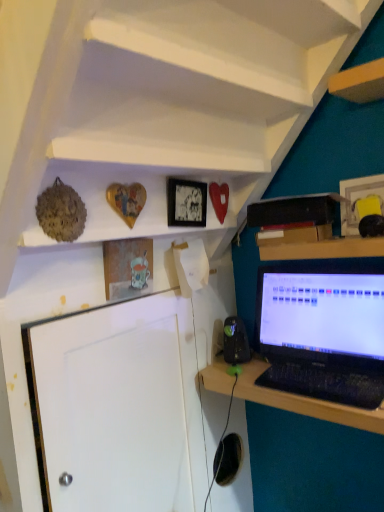
This screenshot has height=512, width=384. Describe the element at coordinates (186, 203) in the screenshot. I see `matte black picture frame at upper center, which ranks as the 2th picture frame in left-to-right order` at that location.

Describe the element at coordinates (124, 265) in the screenshot. I see `matte glass picture frame at upper center, the 1th picture frame positioned from the left` at that location.

Where is `white matte shelf at upper center, arranged as the first shelf when viewed from the top`? Image resolution: width=384 pixels, height=512 pixels. white matte shelf at upper center, arranged as the first shelf when viewed from the top is located at coordinates (236, 39).

Image resolution: width=384 pixels, height=512 pixels. What do you see at coordinates (147, 196) in the screenshot? I see `wooden heart at upper center, arranged as the 2th shelf when viewed from the top` at bounding box center [147, 196].

What is the approximate width of wooden desk at lower right?

The width of wooden desk at lower right is 13.17 inches.

This screenshot has width=384, height=512. Find the location of `black glossy laptop at right`. black glossy laptop at right is located at coordinates (323, 329).

Locate an element on the screen. black plastic speaker at lower center is located at coordinates (235, 341).

Considering the sizes of objects wooden desk at lower right and black plastic keyboard at lower right in the image provided, who is bigger, wooden desk at lower right or black plastic keyboard at lower right?

wooden desk at lower right is bigger.

Where is `computer keyboard behind the wooden desk at lower right`? computer keyboard behind the wooden desk at lower right is located at coordinates (325, 384).

Is wooden desk at lower right oriented away from black plastic keyboard at lower right?

wooden desk at lower right is not turned away from black plastic keyboard at lower right.

Is wooden heart at upper center, arranged as the 2th shelf when viewed from the top, at the left side of black plastic keyboard at lower right?

Yes, wooden heart at upper center, arranged as the 2th shelf when viewed from the top, is to the left of black plastic keyboard at lower right.

Which shelf is the 2nd one when counting from the left side of the black plastic keyboard at lower right? Please provide its 2D coordinates.

[(147, 196)]

From a real-world perspective, who is located higher, wooden heart at upper center, arranged as the 2th shelf when viewed from the top, or black plastic keyboard at lower right?

In real-world perspective, wooden heart at upper center, arranged as the 2th shelf when viewed from the top, is above.

Considering their positions, is black plastic keyboard at lower right located in front of or behind black glossy laptop at right?

Clearly, black plastic keyboard at lower right is in front of black glossy laptop at right.

From the image's perspective, is black plastic keyboard at lower right above black glossy laptop at right?

Incorrect, from the image's perspective, black plastic keyboard at lower right is lower than black glossy laptop at right.

In the scene shown: Between black plastic keyboard at lower right and black glossy laptop at right, which one has more height?

Standing taller between the two is black glossy laptop at right.

Does black plastic keyboard at lower right have a lesser width compared to black glossy laptop at right?

Incorrect, the width of black plastic keyboard at lower right is not less than that of black glossy laptop at right.

Is the depth of matte glass picture frame at upper center, the 1th picture frame positioned from the left, greater than that of matte black picture frame at upper center, which ranks as the 2th picture frame in left-to-right order?

No.

Is matte glass picture frame at upper center, the 1th picture frame positioned from the left, completely or partially outside of matte black picture frame at upper center, which ranks as the 2th picture frame in left-to-right order?

matte glass picture frame at upper center, the 1th picture frame positioned from the left, is positioned outside matte black picture frame at upper center, which ranks as the 2th picture frame in left-to-right order.

Is point (136, 291) positioned before point (195, 214)?

That is True.

From a real-world perspective, which is physically above, matte glass picture frame at upper center, the 1th picture frame positioned from the left, or matte black picture frame at upper center, the 2th picture frame viewed from the right?

matte black picture frame at upper center, the 2th picture frame viewed from the right.

Is wooden desk at lower right oriented away from white matte shelf at upper center, the second shelf when ordered from bottom to top?

No.

Is wooden desk at lower right not inside white matte shelf at upper center, the second shelf when ordered from bottom to top?

Indeed, wooden desk at lower right is completely outside white matte shelf at upper center, the second shelf when ordered from bottom to top.

From a real-world perspective, is wooden desk at lower right on top of white matte shelf at upper center, the second shelf when ordered from bottom to top?

No, from a real-world perspective, wooden desk at lower right is not over white matte shelf at upper center, the second shelf when ordered from bottom to top

Who is bigger, wooden desk at lower right or white matte shelf at upper center, the second shelf when ordered from bottom to top?

Bigger between the two is white matte shelf at upper center, the second shelf when ordered from bottom to top.

Is point (331, 399) closer to camera compared to point (253, 384)?

That is True.

Is black plastic keyboard at lower right positioned with its back to wooden desk at lower right?

black plastic keyboard at lower right does not have its back to wooden desk at lower right.

From a real-world perspective, between black plastic keyboard at lower right and wooden desk at lower right, who is vertically lower?

wooden desk at lower right is physically lower.

Where is `the 2nd shelf in front of the black glossy laptop at right, counting from the anchor's position`? This screenshot has width=384, height=512. the 2nd shelf in front of the black glossy laptop at right, counting from the anchor's position is located at coordinates coord(236,39).

Does black glossy laptop at right have a smaller size compared to white matte shelf at upper center, arranged as the first shelf when viewed from the top?

Indeed, black glossy laptop at right has a smaller size compared to white matte shelf at upper center, arranged as the first shelf when viewed from the top.

Could you tell me if black glossy laptop at right is facing white matte shelf at upper center, arranged as the first shelf when viewed from the top?

No, black glossy laptop at right is not turned towards white matte shelf at upper center, arranged as the first shelf when viewed from the top.

The width and height of the screenshot is (384, 512). I want to click on desk on the left of the black plastic keyboard at lower right, so click(x=304, y=401).

What are the coordinates of `the 1st shelf located above the black plastic keyboard at lower right (from a real-world perspective)` in the screenshot? It's located at (147, 196).

From the image, which object appears to be nearer to white matte shelf at upper center, the second shelf when ordered from bottom to top, black glossy laptop at right or wooden picture frame at upper right, the third picture frame positioned from the left?

wooden picture frame at upper right, the third picture frame positioned from the left.

From the image, which object appears to be farther from wooden picture frame at upper right, the third picture frame positioned from the left, black glossy laptop at right or matte black picture frame at upper center, the 2th picture frame viewed from the right?

matte black picture frame at upper center, the 2th picture frame viewed from the right, is further to wooden picture frame at upper right, the third picture frame positioned from the left.

Which object lies further to the anchor point black glossy laptop at right, matte glass picture frame at upper center, which is counted as the 3th picture frame, starting from the right, or white matte shelf at upper center, arranged as the first shelf when viewed from the top?

white matte shelf at upper center, arranged as the first shelf when viewed from the top, lies further to black glossy laptop at right than the other object.

From the image, which object appears to be farther from wooden desk at lower right, matte glass picture frame at upper center, which is counted as the 3th picture frame, starting from the right, or wooden heart at upper center, which is the first shelf in bottom-to-top order?

Among the two, wooden heart at upper center, which is the first shelf in bottom-to-top order, is located further to wooden desk at lower right.

Considering their positions, is matte glass picture frame at upper center, the 1th picture frame positioned from the left, positioned closer to black glossy laptop at right than wooden heart at upper center, arranged as the 2th shelf when viewed from the top?

wooden heart at upper center, arranged as the 2th shelf when viewed from the top.

When comparing their distances from black glossy laptop at right, does white matte shelf at upper center, arranged as the first shelf when viewed from the top, or wooden picture frame at upper right, placed as the 1th picture frame when sorted from right to left, seem further?

white matte shelf at upper center, arranged as the first shelf when viewed from the top, is positioned further to the anchor black glossy laptop at right.

When comparing their distances from matte black picture frame at upper center, which ranks as the 2th picture frame in left-to-right order, does wooden picture frame at upper right, the third picture frame positioned from the left, or black plastic speaker at lower center seem further?

black plastic speaker at lower center is positioned further to the anchor matte black picture frame at upper center, which ranks as the 2th picture frame in left-to-right order.

Which object lies nearer to the anchor point wooden heart at upper center, arranged as the 2th shelf when viewed from the top, matte glass picture frame at upper center, the 1th picture frame positioned from the left, or black glossy laptop at right?

matte glass picture frame at upper center, the 1th picture frame positioned from the left.

Find the location of a particular element. This screenshot has height=512, width=384. laptop between white matte shelf at upper center, arranged as the first shelf when viewed from the top, and wooden desk at lower right in the up-down direction is located at coordinates (323, 329).

At what (x,y) coordinates should I click in order to perform the action: click on shelf that lies between white matte shelf at upper center, the second shelf when ordered from bottom to top, and black glossy laptop at right from top to bottom. Please return your answer as a coordinate pair (x, y). The image size is (384, 512). Looking at the image, I should click on (147, 196).

Identify the location of shelf between white matte shelf at upper center, arranged as the first shelf when viewed from the top, and wooden desk at lower right in the up-down direction. (147, 196).

The width and height of the screenshot is (384, 512). What are the coordinates of `computer keyboard between white matte shelf at upper center, the second shelf when ordered from bottom to top, and wooden desk at lower right vertically` in the screenshot? It's located at (325, 384).